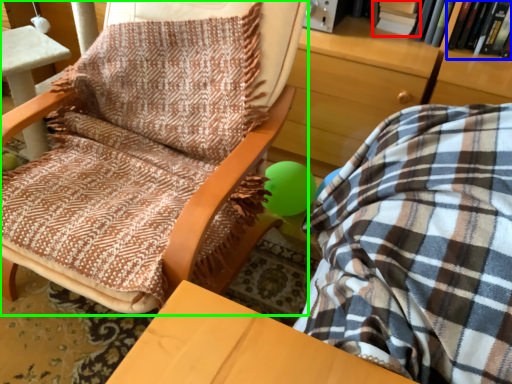
Question: Based on their relative distances, which object is nearer to book (highlighted by a red box)? Choose from book (highlighted by a blue box) and chair (highlighted by a green box).

Choices:
 (A) book
 (B) chair

Answer: (A)